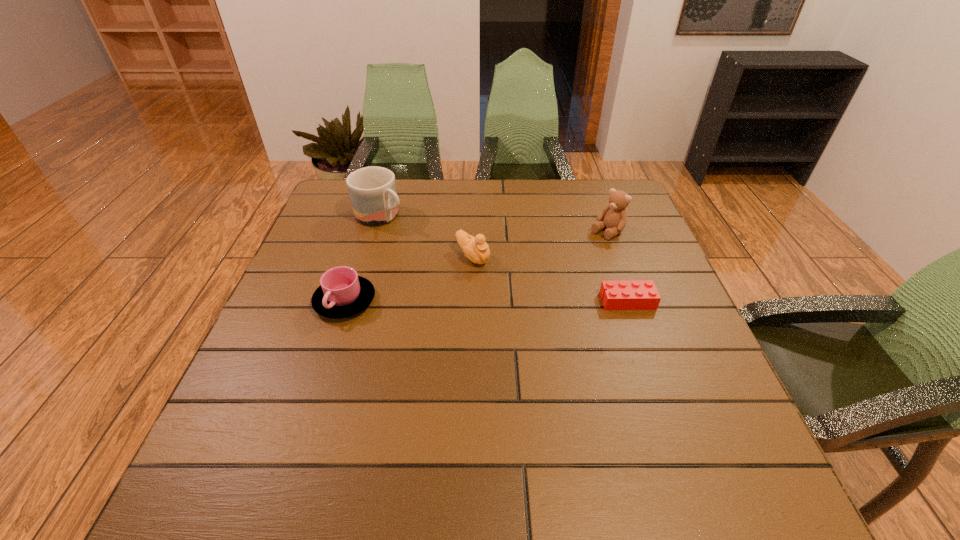
Where is `free point located 0.380m on the face of the teddy bear`? free point located 0.380m on the face of the teddy bear is located at coordinates (499, 307).

Where is `vacant space located 0.220m on the face of the duckling`? This screenshot has width=960, height=540. vacant space located 0.220m on the face of the duckling is located at coordinates (545, 316).

Locate an element on the screen. vacant space situated on the face of the duckling is located at coordinates (516, 292).

You are a GUI agent. You are given a task and a screenshot of the screen. Output one action in this format:
    pyautogui.click(x=<x>, y=<y>)
    Task: Click on the vacant space located on the face of the duckling
    This screenshot has width=960, height=540.
    Given the screenshot: What is the action you would take?
    click(x=548, y=318)

Image resolution: width=960 pixels, height=540 pixels. Identify the location of free space located 0.100m on the side with the handle of the mug. (420, 240).

You are a GUI agent. You are given a task and a screenshot of the screen. Output one action in this format:
    pyautogui.click(x=<x>, y=<y>)
    Task: Click on the free location located on the side with the handle of the mug
    The width and height of the screenshot is (960, 540).
    Given the screenshot: What is the action you would take?
    pyautogui.click(x=486, y=279)

You are a GUI agent. You are given a task and a screenshot of the screen. Output one action in this format:
    pyautogui.click(x=<x>, y=<y>)
    Task: Click on the vacant region located 0.280m on the side with the handle of the mug
    The width and height of the screenshot is (960, 540).
    Given the screenshot: What is the action you would take?
    tap(468, 268)

Find the location of a particular element. The width and height of the screenshot is (960, 540). object located at the far edge is located at coordinates (372, 190).

This screenshot has height=540, width=960. I want to click on cup that is at the left edge, so click(x=342, y=293).

You are a GUI agent. You are given a task and a screenshot of the screen. Output one action in this format:
    pyautogui.click(x=<x>, y=<y>)
    Task: Click on the mug that is at the left edge
    The image size is (960, 540).
    Given the screenshot: What is the action you would take?
    pyautogui.click(x=372, y=190)